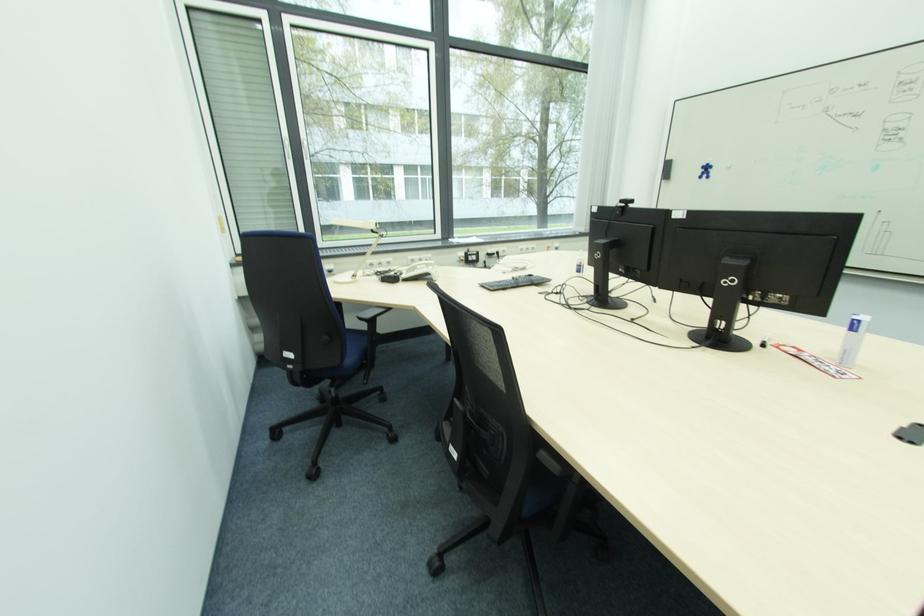
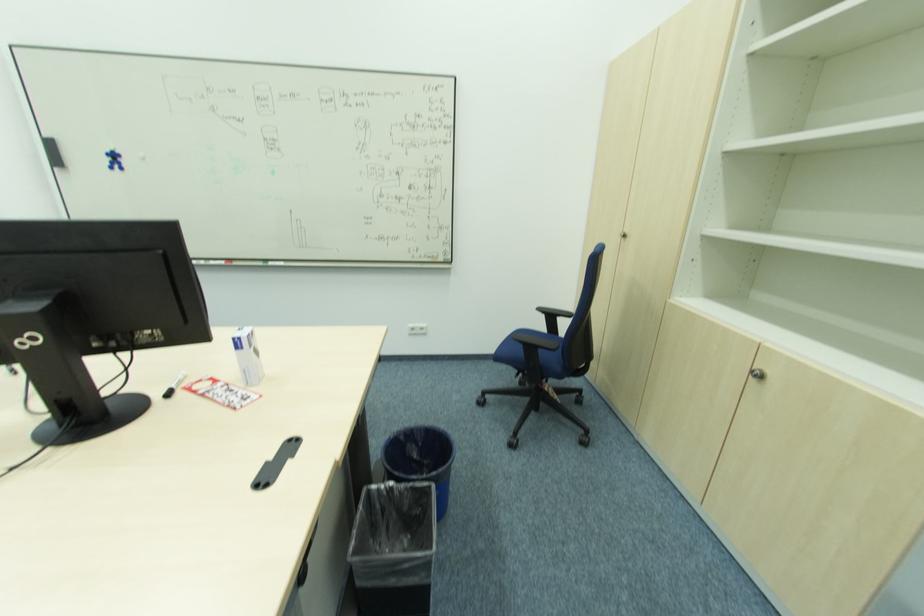
Locate, in the second image, the point that corresponds to point (737, 283) in the first image.

(42, 341)